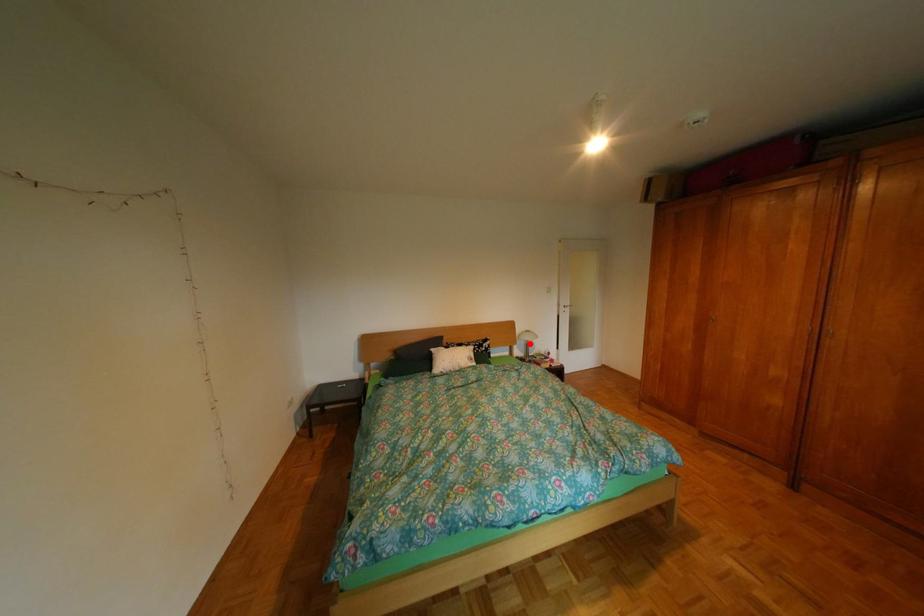
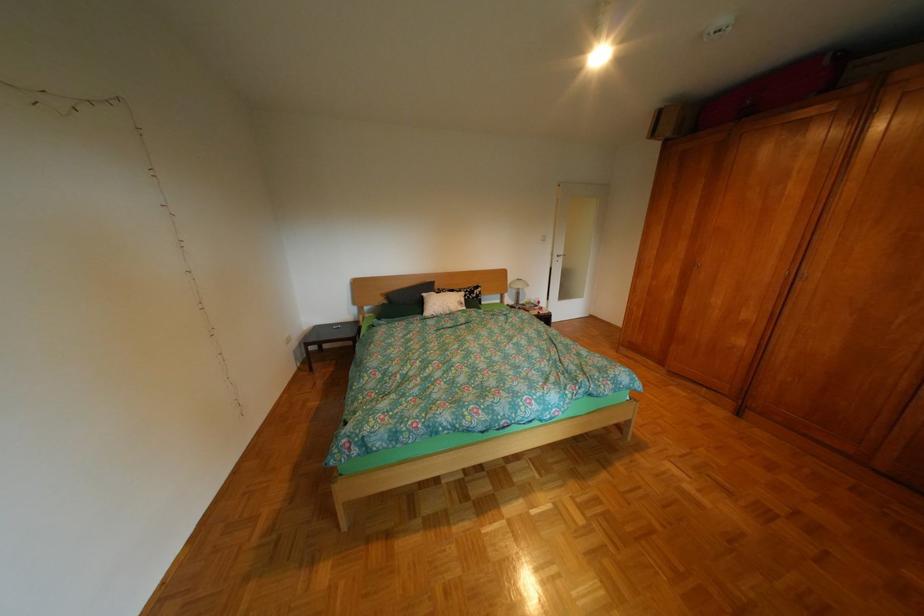
The point at the highlighted location is marked in the first image. Where is the corresponding point in the second image?

(521, 292)